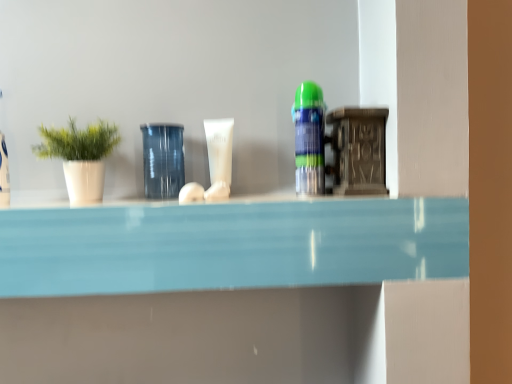
Question: Is white matte tube at center, arranged as the 2th toiletry when viewed from the front, inside the boundaries of translucent plastic spray can at center, marked as the first toiletry in a front-to-back arrangement, or outside?

Choices:
 (A) outside
 (B) inside

Answer: (A)

Question: Is point (210, 147) positioned closer to the camera than point (313, 162)?

Choices:
 (A) farther
 (B) closer

Answer: (A)

Question: Considering the real-world distances, which object is closest to the transparent glass jar at center?

Choices:
 (A) white matte pot at left
 (B) translucent plastic spray can at center, which appears as the first toiletry when viewed from the right
 (C) white matte tube at center, the first toiletry positioned from the back

Answer: (C)

Question: Which is nearer to the translucent plastic spray can at center, which appears as the second toiletry when viewed from the left?

Choices:
 (A) transparent glass jar at center
 (B) white matte tube at center, arranged as the 2th toiletry when viewed from the front
 (C) white matte pot at left

Answer: (B)